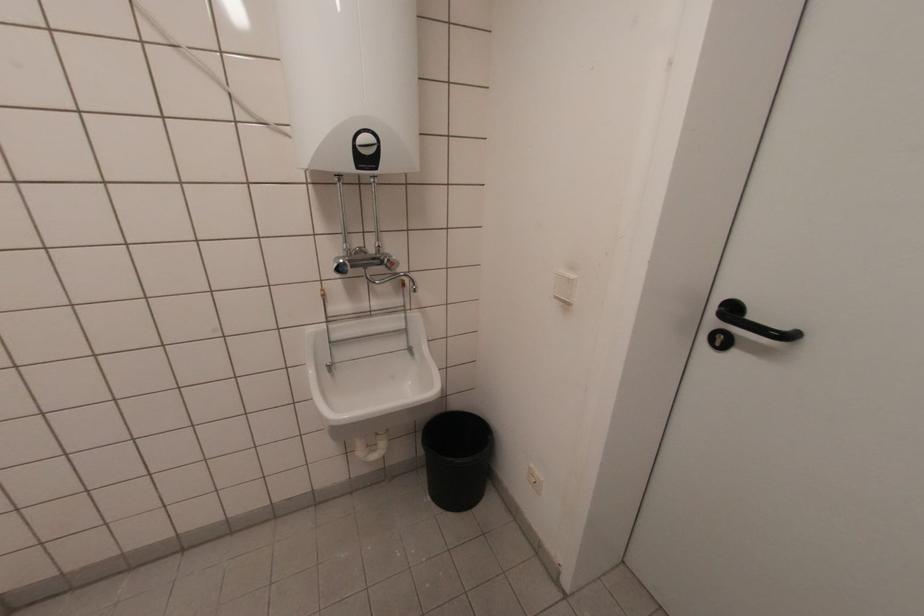
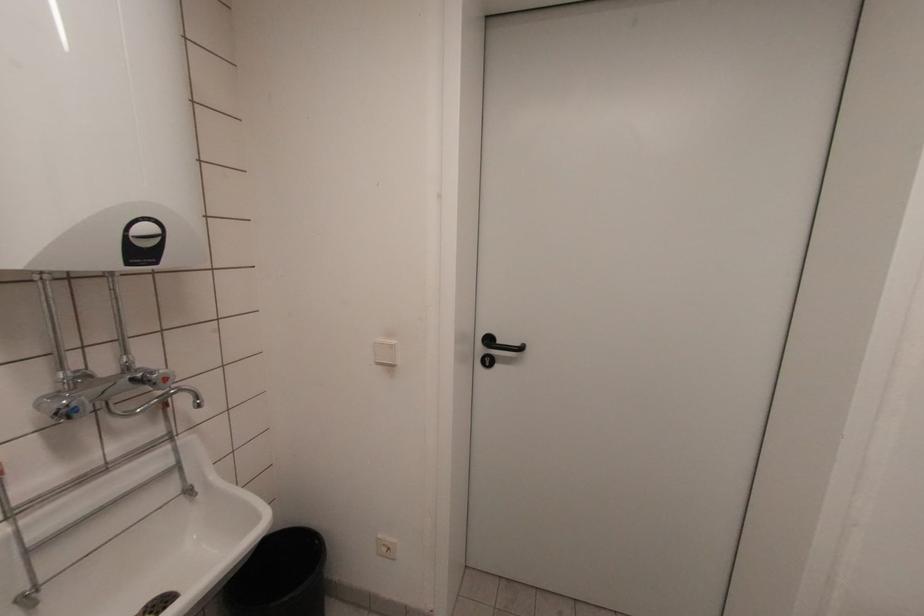
Question: I am providing you with two images of the same scene from different viewpoints. Please identify which objects are invisible in image2.

Choices:
 (A) white light switch
 (B) black control dial
 (C) blue faucet handle
 (D) none of these

Answer: (D)